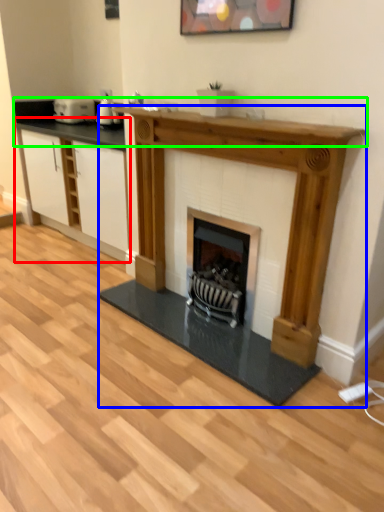
Question: Which object is the closest to the cabinetry (highlighted by a red box)? Choose among these: fireplace (highlighted by a blue box) or counter top (highlighted by a green box).

Choices:
 (A) fireplace
 (B) counter top

Answer: (B)